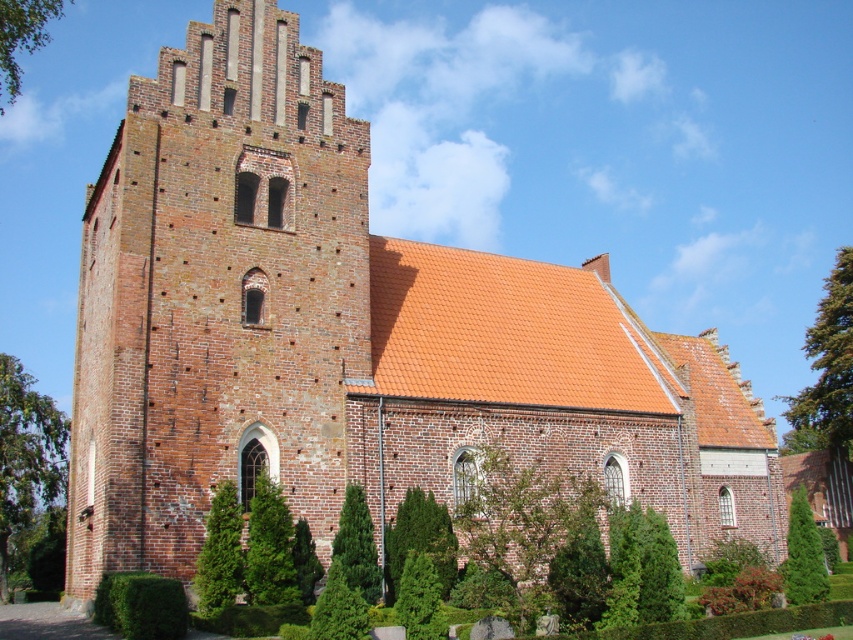
You are a gardener planning to trim both the green textured hedge at center and the green textured bush at center. Based on their sizes, which one requires more time to maintain?

The green textured hedge at center might be wider than green textured bush at center, so it likely requires more time to maintain.

You are a gardener planning to trim the green textured hedge at center and the green coniferous tree at lower right. Which of these two plants requires more effort due to its larger size?

The green coniferous tree at lower right requires more effort because it is larger than the green textured hedge at center.

You are standing in front of the historic brick church and notice a point marked at coordinates (25, 452). Based on the scene description, can you identify what this point is located on?

The point at coordinates (25, 452) is located on the green leafy tree at left.